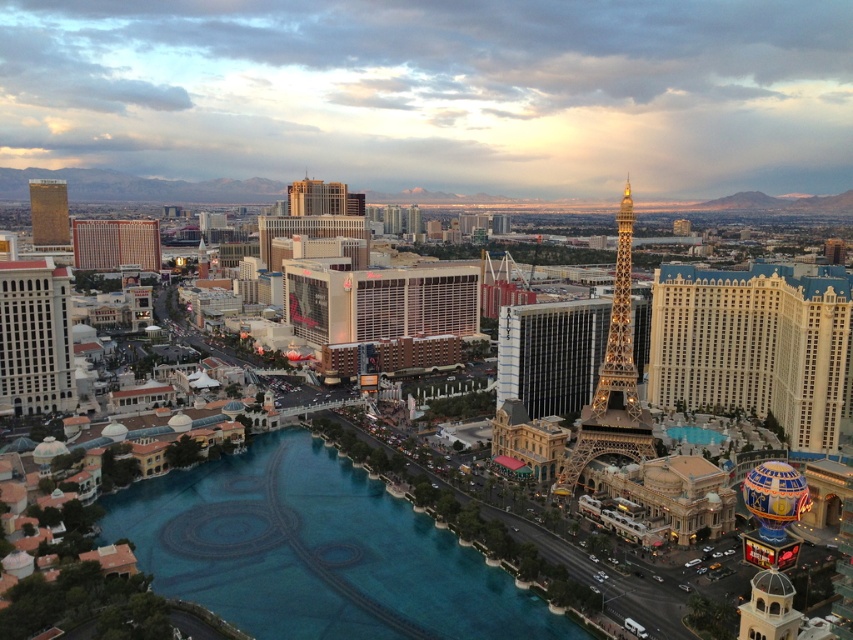
Question: Can you confirm if gold metallic eiffel tower at center is thinner than gold metallic eiffel tower at center-right?

Choices:
 (A) yes
 (B) no

Answer: (B)

Question: Among these objects, which one is nearest to the camera?

Choices:
 (A) gold reflective tower at upper left
 (B) blue glass water at center
 (C) glassy reflective building at center
 (D) gold metallic eiffel tower at center-right

Answer: (B)

Question: Based on their relative distances, which object is nearer to the blue glass water at center?

Choices:
 (A) gold metallic eiffel tower at center
 (B) gold reflective tower at upper left
 (C) glassy reflective building at center

Answer: (A)

Question: Which object is closer to the camera taking this photo?

Choices:
 (A) blue glass water at center
 (B) gold metallic eiffel tower at center-right

Answer: (A)

Question: Does blue glass water at center appear over shiny gold metal eiffel tower at center right?

Choices:
 (A) no
 (B) yes

Answer: (A)

Question: Can you confirm if gold metallic eiffel tower at center is positioned to the right of shiny gold metal eiffel tower at center right?

Choices:
 (A) yes
 (B) no

Answer: (B)